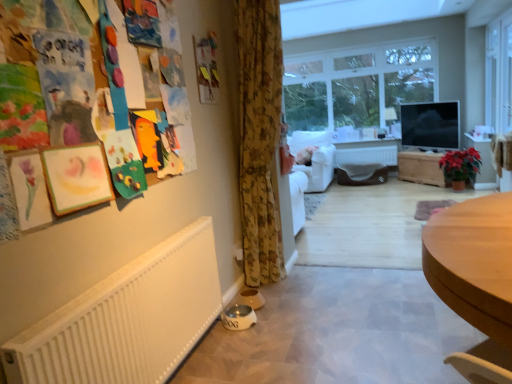
Question: Should I look upward or downward to see white matte radiator at center?

Choices:
 (A) up
 (B) down

Answer: (A)

Question: Can you confirm if white fabric armchair at center is positioned to the left of transparent glass window at upper right, positioned as the first window in right-to-left order?

Choices:
 (A) yes
 (B) no

Answer: (A)

Question: From the image's perspective, does white fabric armchair at center appear lower than transparent glass window at upper right, the 2th window in the back-to-front sequence?

Choices:
 (A) no
 (B) yes

Answer: (B)

Question: Could you tell me if white fabric armchair at center is facing transparent glass window at upper right, the 2th window in the back-to-front sequence?

Choices:
 (A) yes
 (B) no

Answer: (B)

Question: Is white fabric armchair at center shorter than transparent glass window at upper right, the 2th window in the back-to-front sequence?

Choices:
 (A) yes
 (B) no

Answer: (A)

Question: Does white fabric armchair at center have a smaller size compared to transparent glass window at upper right, positioned as the first window in right-to-left order?

Choices:
 (A) yes
 (B) no

Answer: (B)

Question: Is white fabric armchair at center wider than transparent glass window at upper right, positioned as the first window in right-to-left order?

Choices:
 (A) no
 (B) yes

Answer: (B)

Question: From the image's perspective, is white fabric armchair at center located beneath wooden chest at center?

Choices:
 (A) yes
 (B) no

Answer: (B)

Question: Would you consider white fabric armchair at center to be distant from wooden chest at center?

Choices:
 (A) no
 (B) yes

Answer: (B)

Question: Does white fabric armchair at center appear on the right side of wooden chest at center?

Choices:
 (A) yes
 (B) no

Answer: (B)

Question: From the image's perspective, is white fabric armchair at center over wooden chest at center?

Choices:
 (A) no
 (B) yes

Answer: (B)

Question: From a real-world perspective, is white fabric armchair at center positioned over wooden chest at center based on gravity?

Choices:
 (A) yes
 (B) no

Answer: (A)

Question: Could you tell me if white fabric armchair at center is turned towards wooden chest at center?

Choices:
 (A) no
 (B) yes

Answer: (A)

Question: From a real-world perspective, is white glossy dog bowl at lower left positioned under light brown wooden desk at lower right based on gravity?

Choices:
 (A) no
 (B) yes

Answer: (B)